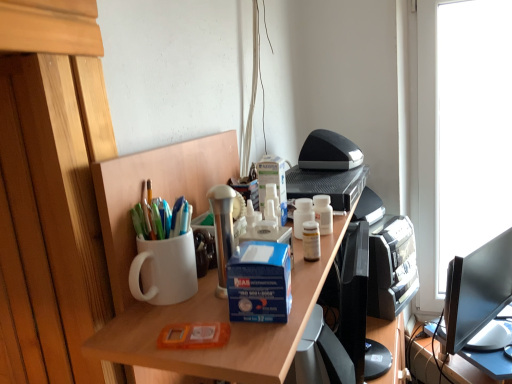
Question: Which direction should I rotate to look at white glossy bottle at upper center, which ranks as the 1th stationery in top-to-bottom order?

Choices:
 (A) left
 (B) right

Answer: (B)

Question: From a real-world perspective, is blue cardboard box at center over white glossy bottle at upper center, acting as the first stationery starting from the right?

Choices:
 (A) no
 (B) yes

Answer: (B)

Question: Is white glossy bottle at upper center, the 1th stationery when ordered from back to front, located within blue cardboard box at center?

Choices:
 (A) no
 (B) yes

Answer: (A)

Question: From the image's perspective, would you say blue cardboard box at center is positioned over white glossy bottle at upper center, the second stationery in the bottom-to-top sequence?

Choices:
 (A) yes
 (B) no

Answer: (B)

Question: Can you confirm if blue cardboard box at center is taller than white glossy bottle at upper center, the second stationery from the front?

Choices:
 (A) no
 (B) yes

Answer: (B)

Question: Does blue cardboard box at center turn towards white glossy bottle at upper center, acting as the second stationery starting from the left?

Choices:
 (A) no
 (B) yes

Answer: (A)

Question: Does blue cardboard box at center come in front of white glossy bottle at upper center, which ranks as the 1th stationery in top-to-bottom order?

Choices:
 (A) no
 (B) yes

Answer: (B)

Question: Is orange plastic case at center, positioned as the second stationery in back-to-front order, positioned far away from blue cardboard box at center?

Choices:
 (A) yes
 (B) no

Answer: (B)

Question: From the image's perspective, is orange plastic case at center, arranged as the first stationery when ordered from the bottom, above blue cardboard box at center?

Choices:
 (A) no
 (B) yes

Answer: (A)

Question: Considering the relative sizes of orange plastic case at center, positioned as the second stationery in back-to-front order, and blue cardboard box at center in the image provided, is orange plastic case at center, positioned as the second stationery in back-to-front order, thinner than blue cardboard box at center?

Choices:
 (A) yes
 (B) no

Answer: (A)

Question: From a real-world perspective, does orange plastic case at center, the 2th stationery viewed from the right, stand above blue cardboard box at center?

Choices:
 (A) no
 (B) yes

Answer: (A)

Question: Is orange plastic case at center, the 2th stationery viewed from the right, taller than blue cardboard box at center?

Choices:
 (A) no
 (B) yes

Answer: (A)

Question: Can you confirm if orange plastic case at center, positioned as the 1th stationery in left-to-right order, is smaller than blue cardboard box at center?

Choices:
 (A) yes
 (B) no

Answer: (A)

Question: Is orange plastic case at center, positioned as the 1th stationery in left-to-right order, facing away from white matte desk at center?

Choices:
 (A) no
 (B) yes

Answer: (A)